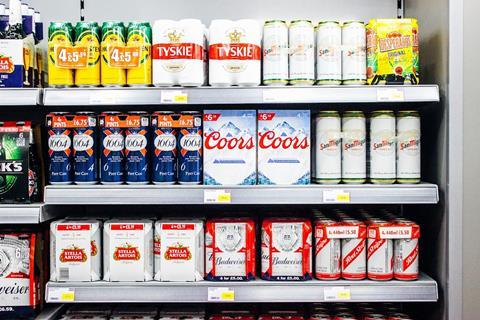
Find any how many shelves? in the picture. Your answer should be formatted as a list of tuples, i.e. [(x1, y1), (x2, y2), ...], where each tuple contains the x and y coordinates of a point satisfying the conditions above.

[(20, 94), (61, 100), (23, 212), (69, 196), (46, 314), (116, 296)]